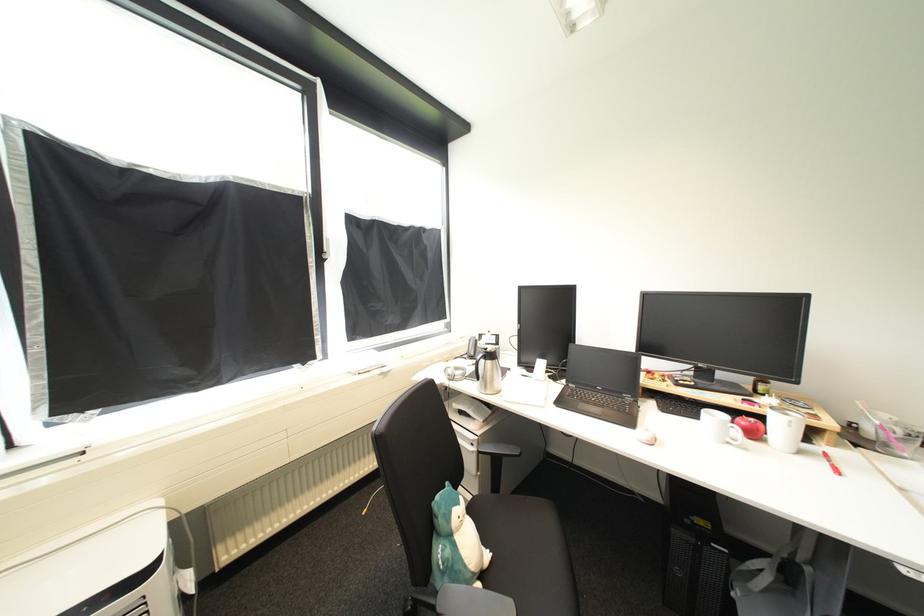
Locate an element on the screen. The height and width of the screenshot is (616, 924). red apple is located at coordinates (749, 427).